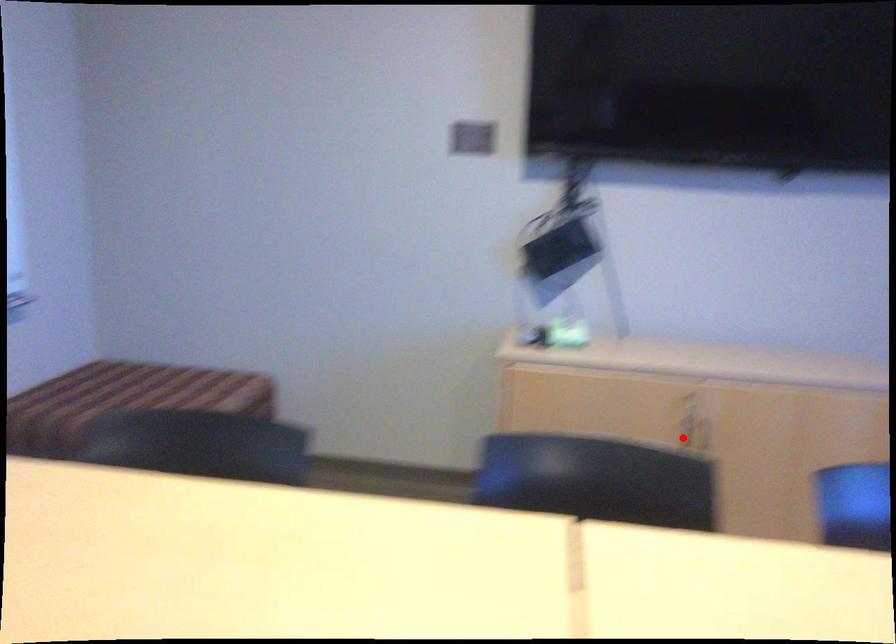
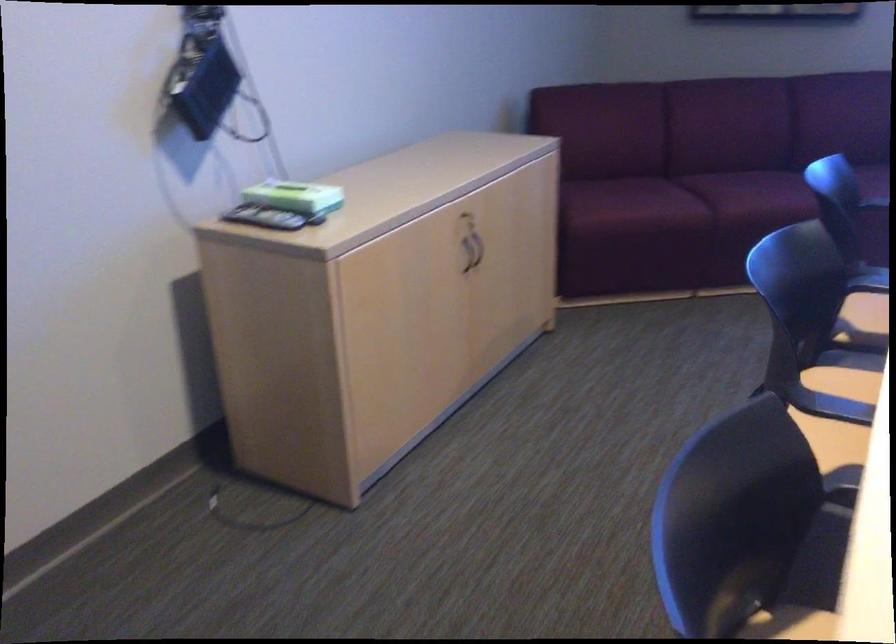
In the second image, find the point that corresponds to the highlighted location in the first image.

(464, 259)